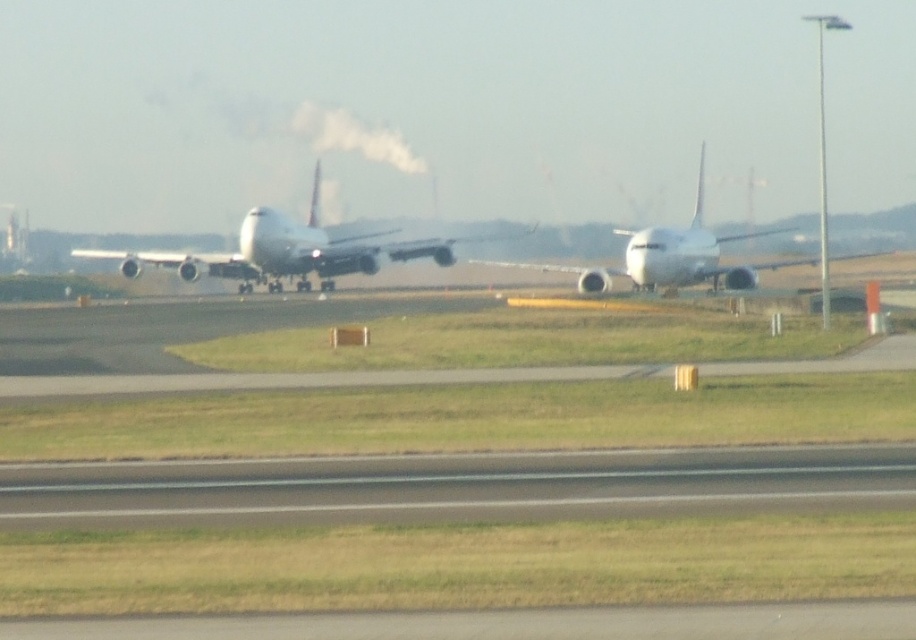
Is point (478, 496) positioned before point (696, 276)?

Yes.

Is gray asphalt runway at lower center further to camera compared to white glossy airplane at center?

No, it is in front of white glossy airplane at center.

Who is more distant from viewer, (658, 452) or (533, 262)?

The point (533, 262) is behind.

In order to click on gray asphalt runway at lower center in this screenshot , I will do coord(455,483).

Does gray asphalt runway at lower center appear over white matte airplane at center?

No.

Based on the photo, who is positioned more to the right, gray asphalt runway at lower center or white matte airplane at center?

From the viewer's perspective, gray asphalt runway at lower center appears more on the right side.

Is point (833, 499) positioned behind point (137, 275)?

No.

The width and height of the screenshot is (916, 640). I want to click on gray asphalt runway at lower center, so click(x=455, y=483).

Does white matte airplane at center appear over white glossy airplane at center?

Actually, white matte airplane at center is below white glossy airplane at center.

Is point (287, 257) positioned before point (729, 234)?

Yes, point (287, 257) is closer to viewer.

This screenshot has height=640, width=916. I want to click on white matte airplane at center, so click(x=289, y=252).